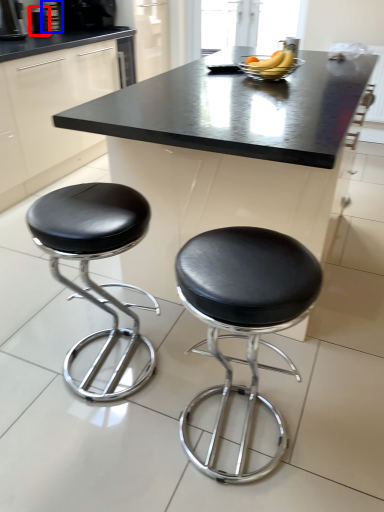
Question: Among these objects, which one is nearest to the camera, appliance (highlighted by a red box) or appliance (highlighted by a blue box)?

Choices:
 (A) appliance
 (B) appliance

Answer: (A)